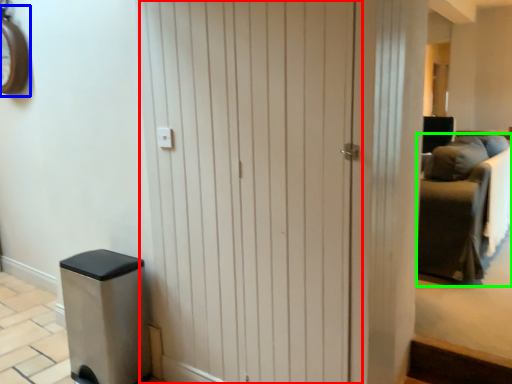
Question: Which object is the closest to the barn door (highlighted by a red box)? Choose among these: clock (highlighted by a blue box) or furniture (highlighted by a green box).

Choices:
 (A) clock
 (B) furniture

Answer: (B)